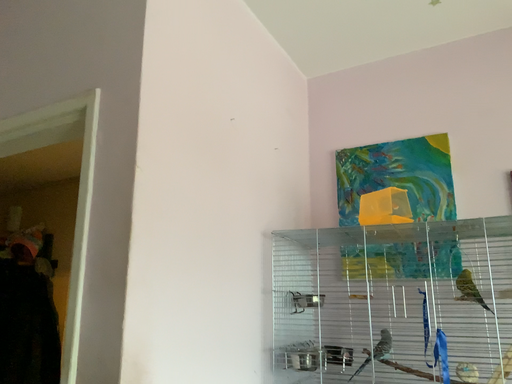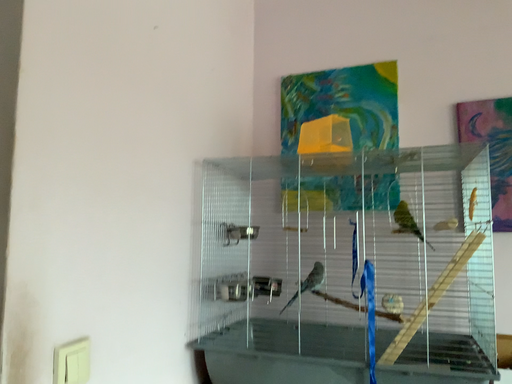
Question: How did the camera likely rotate when shooting the video?

Choices:
 (A) rotated upward
 (B) rotated downward

Answer: (B)